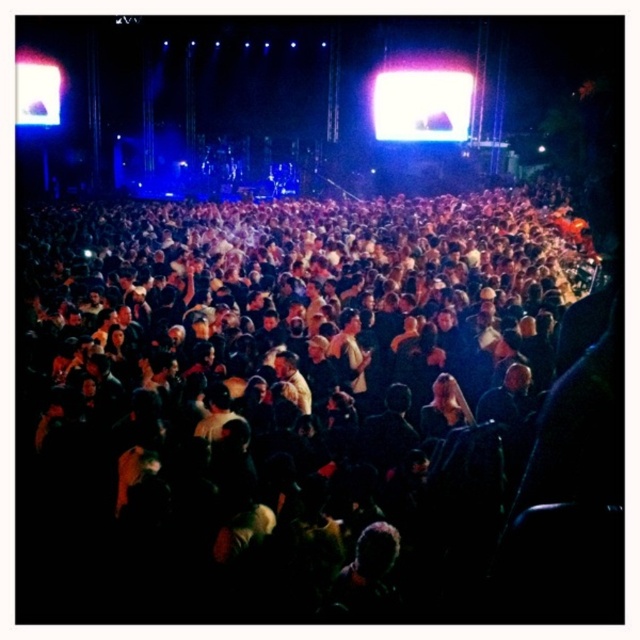
Question: Which object is closer to the camera taking this photo?

Choices:
 (A) dark matte crowd at center
 (B) bright white screen at upper center
 (C) white glossy screen at upper left

Answer: (A)

Question: Can you confirm if dark matte crowd at center is positioned above white glossy screen at upper left?

Choices:
 (A) no
 (B) yes

Answer: (A)

Question: Is dark matte crowd at center positioned behind bright white screen at upper center?

Choices:
 (A) yes
 (B) no

Answer: (B)

Question: Is the position of bright white screen at upper center less distant than that of white glossy screen at upper left?

Choices:
 (A) no
 (B) yes

Answer: (A)

Question: Which of the following is the closest to the observer?

Choices:
 (A) (x=401, y=120)
 (B) (x=19, y=109)
 (C) (x=381, y=584)

Answer: (C)

Question: Which object is positioned closest to the bright white screen at upper center?

Choices:
 (A) dark matte crowd at center
 (B) white glossy screen at upper left

Answer: (A)